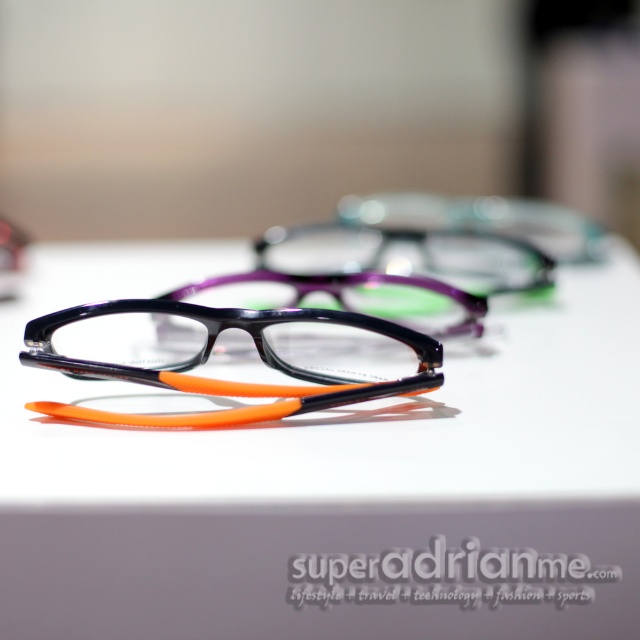
Question: Does matte black frame at center have a larger size compared to translucent orange plastic glasses at center?

Choices:
 (A) yes
 (B) no

Answer: (A)

Question: Does matte black frame at center have a greater width compared to translucent orange plastic glasses at center?

Choices:
 (A) yes
 (B) no

Answer: (A)

Question: Which is farther from the white plastic glasses at center?

Choices:
 (A) translucent orange plastic glasses at center
 (B) matte purple glasses at center

Answer: (B)

Question: Which of these objects is positioned farthest from the translucent orange plastic glasses at center?

Choices:
 (A) matte black frame at center
 (B) white plastic glasses at center
 (C) matte purple glasses at center

Answer: (B)

Question: Is matte black frame at center closer to the viewer compared to matte purple glasses at center?

Choices:
 (A) yes
 (B) no

Answer: (A)

Question: Among these points, which one is nearest to the camera?

Choices:
 (A) (337, 250)
 (B) (172, 588)

Answer: (B)